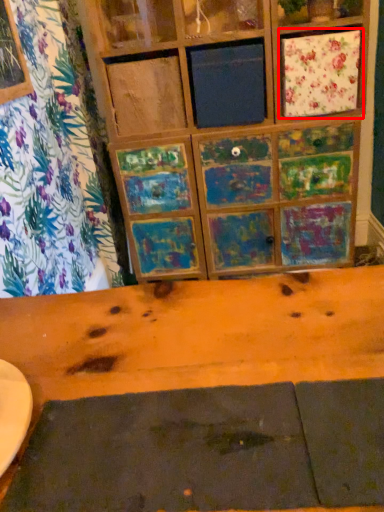
Question: Where is cabinetry (annotated by the red box) located in relation to plank in the image?

Choices:
 (A) left
 (B) right

Answer: (B)